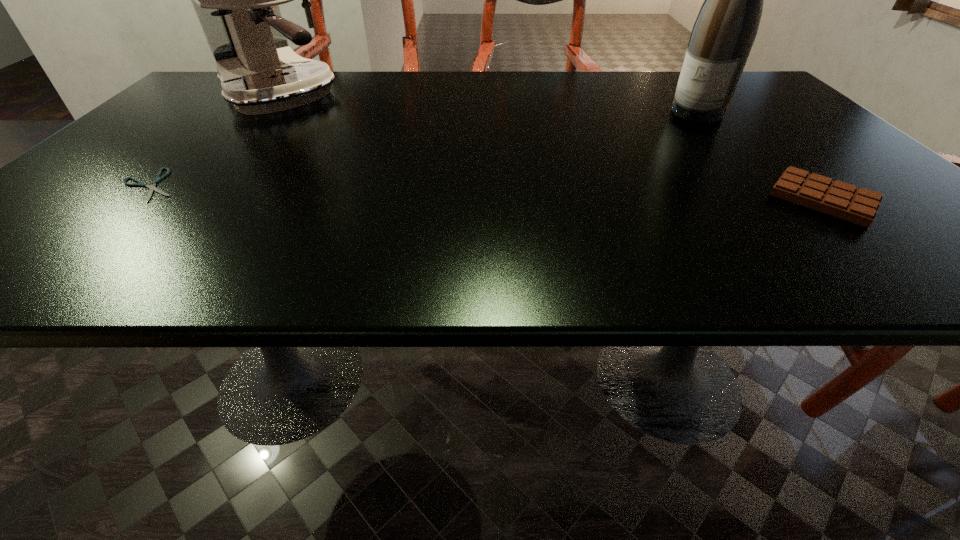
The height and width of the screenshot is (540, 960). Find the location of `vacant space located 0.240m on the front-facing side of the coffee maker`. vacant space located 0.240m on the front-facing side of the coffee maker is located at coordinates (364, 158).

At what (x,y) coordinates should I click in order to perform the action: click on vacant space located 0.200m on the front-facing side of the coffee maker. Please return your answer as a coordinate pair (x, y). The width and height of the screenshot is (960, 540). Looking at the image, I should click on (354, 151).

Find the location of a particular element. wine bottle that is at the far edge is located at coordinates (722, 37).

At what (x,y) coordinates should I click in order to perform the action: click on coffee maker that is positioned at the far edge. Please return your answer as a coordinate pair (x, y). The width and height of the screenshot is (960, 540). Looking at the image, I should click on (236, 0).

The image size is (960, 540). In order to click on object that is at the near edge in this screenshot , I will do `click(836, 198)`.

Image resolution: width=960 pixels, height=540 pixels. Find the location of `shears present at the left edge`. shears present at the left edge is located at coordinates pyautogui.click(x=152, y=187).

Locate an element on the screen. This screenshot has width=960, height=540. coffee maker at the left edge is located at coordinates (236, 0).

The height and width of the screenshot is (540, 960). What are the coordinates of `candy bar present at the right edge` in the screenshot? It's located at point(836,198).

I want to click on wine bottle that is at the right edge, so pos(722,37).

At what (x,y) coordinates should I click in order to perform the action: click on object located in the far left corner section of the desktop. Please return your answer as a coordinate pair (x, y). Looking at the image, I should click on (236, 0).